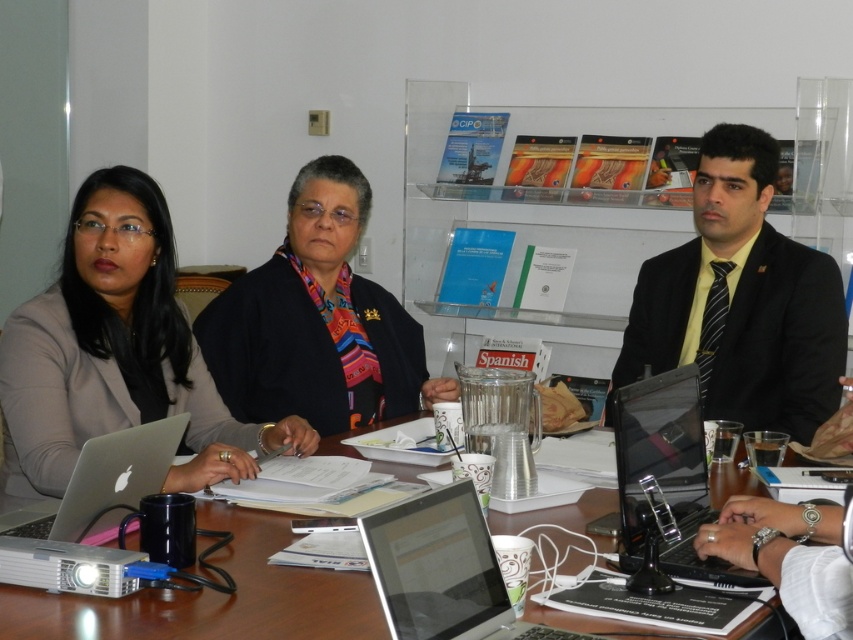
You are a participant in the meeting and need to quickly access the silver metallic laptop at center and the black glossy laptop at center. Which one can you reach first without moving your chair?

The silver metallic laptop at center is closer to the viewer than the black glossy laptop at center, so you can reach it first without moving your chair.

You are a meeting participant who needs to quickly access both laptops. Which laptop, the silver metallic laptop at center or the black glossy laptop at center, is located to the left of the other?

The silver metallic laptop at center is positioned on the left side of the black glossy laptop at center, so the silver metallic laptop at center is located to the left of the black glossy laptop at center.

Please provide the coordinates of the matte black jacket at upper left in the image. The coordinates should be in the format of a point with two decimal places, such as point (117, 352).

The coordinates of the matte black jacket at upper left are point (117, 352).